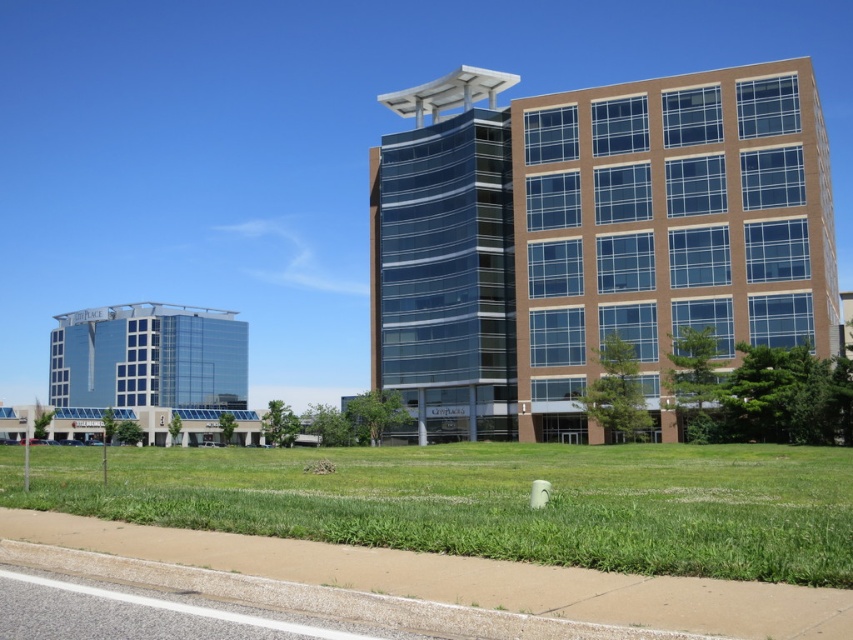
You are a delivery drone that needs to deliver a package to the brown glass building at center. You are currently hovering above the green grass at lower center. What is the approximate distance you need to fly to reach the building?

The distance between the brown glass building at center and the green grass at lower center is 29.90 meters, so the drone needs to fly approximately 29.90 meters to reach the building.